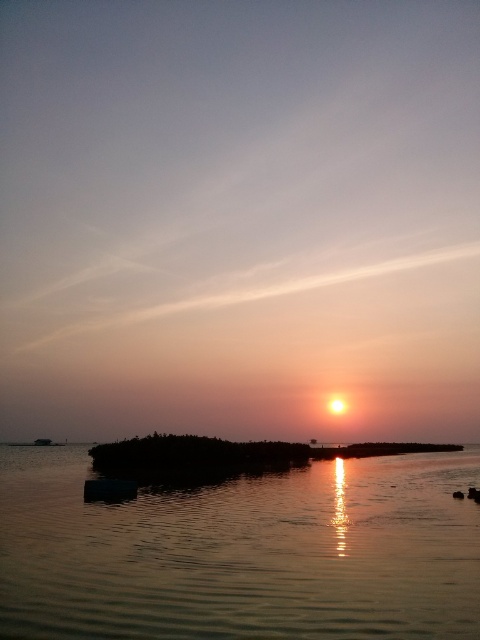
Does silvery reflective water at center have a lesser width compared to silky sand at center?

Yes, silvery reflective water at center is thinner than silky sand at center.

This screenshot has height=640, width=480. Identify the location of silvery reflective water at center. (242, 552).